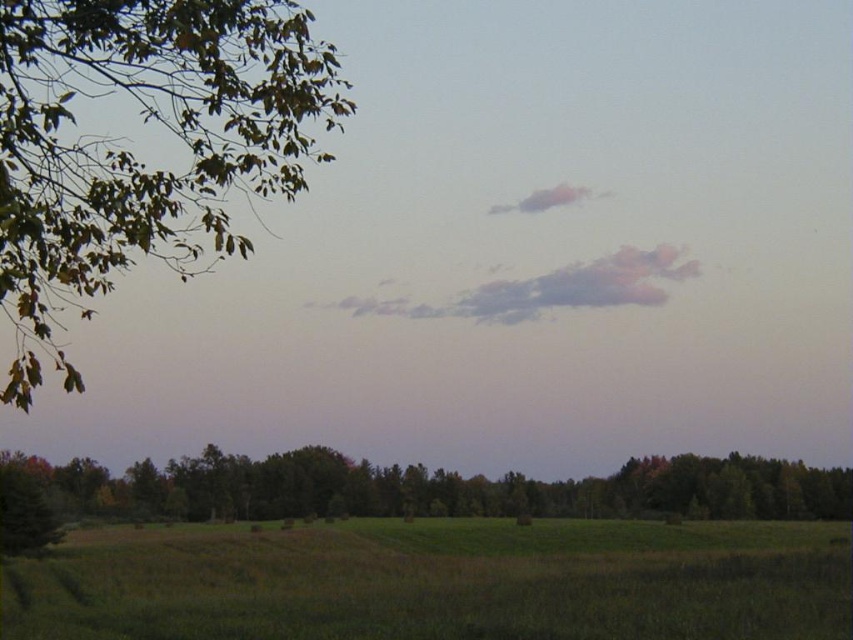
Who is taller, green leafy tree at lower center or pink fluffy cloud at upper center?

With more height is green leafy tree at lower center.

Does green leafy tree at lower center have a lesser width compared to pink fluffy cloud at upper center?

No.

Which is behind, point (735, 481) or point (583, 193)?

Point (583, 193)

Image resolution: width=853 pixels, height=640 pixels. In order to click on green leafy tree at lower center in this screenshot , I will do `click(439, 488)`.

Does pink cotton cloud at upper center lie in front of pink fluffy cloud at upper center?

Yes.

The image size is (853, 640). Describe the element at coordinates (550, 289) in the screenshot. I see `pink cotton cloud at upper center` at that location.

Is point (572, 280) closer to camera compared to point (592, 195)?

Yes, point (572, 280) is in front of point (592, 195).

Where is `pink cotton cloud at upper center`? pink cotton cloud at upper center is located at coordinates (550, 289).

Who is positioned more to the right, green grassy field at lower center or pink fluffy cloud at upper center?

Positioned to the right is pink fluffy cloud at upper center.

Can you confirm if green grassy field at lower center is thinner than pink fluffy cloud at upper center?

No, green grassy field at lower center is not thinner than pink fluffy cloud at upper center.

Image resolution: width=853 pixels, height=640 pixels. What do you see at coordinates (437, 580) in the screenshot? I see `green grassy field at lower center` at bounding box center [437, 580].

In order to click on green grassy field at lower center in this screenshot , I will do `click(437, 580)`.